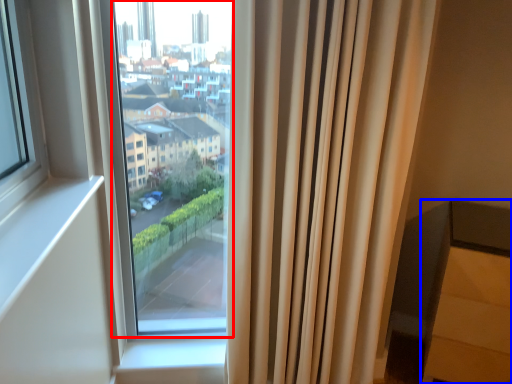
Question: Which of the following is the closest to the observer, bay window (highlighted by a red box) or furniture (highlighted by a blue box)?

Choices:
 (A) bay window
 (B) furniture

Answer: (A)